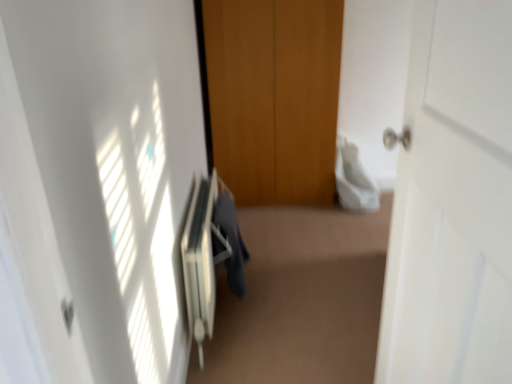
Question: Does point (202, 248) appear closer or farther from the camera than point (223, 183)?

Choices:
 (A) closer
 (B) farther

Answer: (A)

Question: Considering their positions, is white plastic radiator at center located in front of or behind dark gray fabric at center?

Choices:
 (A) front
 (B) behind

Answer: (A)

Question: Which object is the farthest from the dark gray fabric at center?

Choices:
 (A) white plastic radiator at center
 (B) white matte door at right

Answer: (B)

Question: Estimate the real-world distances between objects in this image. Which object is farther from the white plastic radiator at center?

Choices:
 (A) dark gray fabric at center
 (B) white matte door at right

Answer: (B)